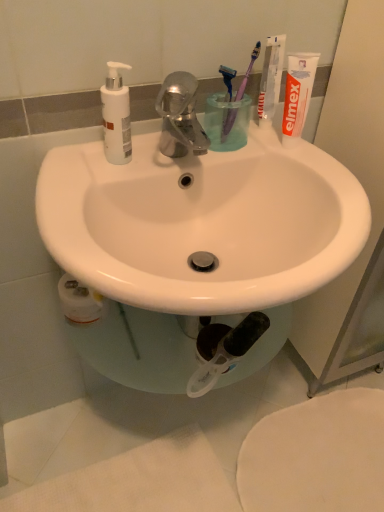
Find the location of `vacant space in front of white matte pump bottle at upper left`. vacant space in front of white matte pump bottle at upper left is located at coordinates (84, 194).